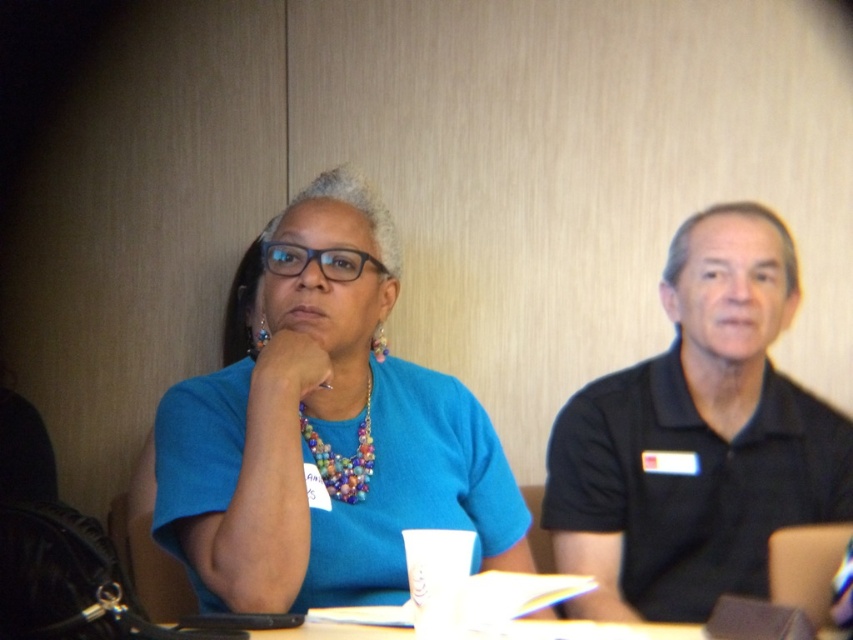
Question: Estimate the real-world distances between objects in this image. Which object is farther from the blue fabric shirt at center?

Choices:
 (A) transparent plastic glasses at center
 (B) black polo shirt at right

Answer: (B)

Question: Where is blue fabric shirt at center located in relation to black polo shirt at right in the image?

Choices:
 (A) left
 (B) right

Answer: (A)

Question: Which point appears farthest from the camera in this image?

Choices:
 (A) [329, 568]
 (B) [762, 548]

Answer: (B)

Question: Among these objects, which one is farthest from the camera?

Choices:
 (A) blue fabric shirt at center
 (B) multicolored beaded necklace at center

Answer: (B)

Question: Is black polo shirt at right bigger than transparent plastic glasses at center?

Choices:
 (A) no
 (B) yes

Answer: (B)

Question: Where is blue fabric shirt at center located in relation to black polo shirt at right in the image?

Choices:
 (A) right
 (B) left

Answer: (B)